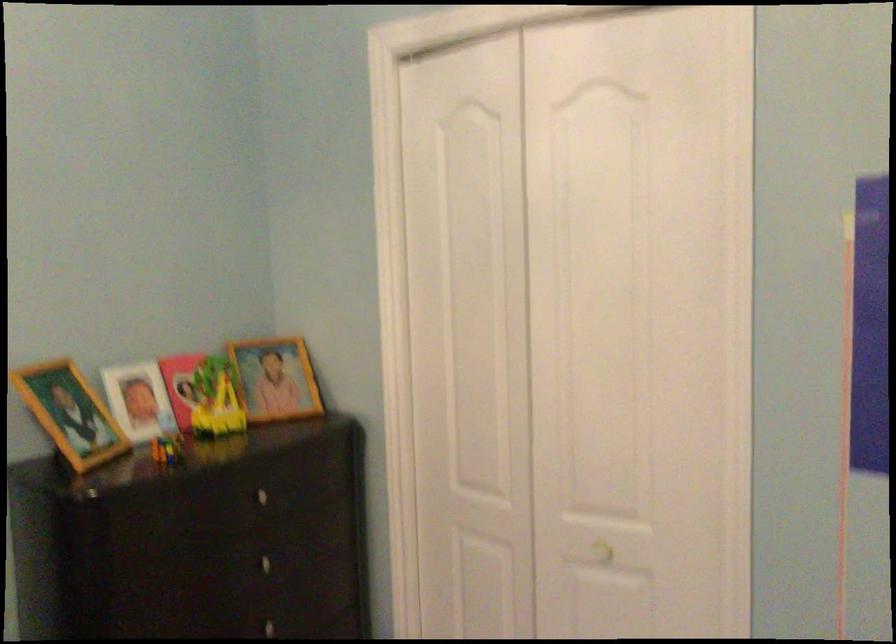
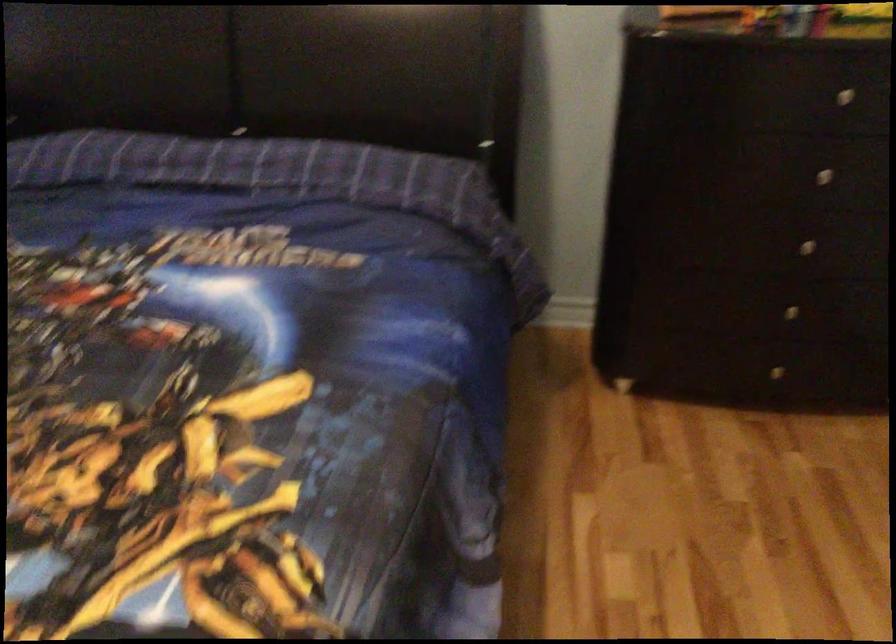
Consider the image. The first image is from the beginning of the video and the second image is from the end. How did the camera likely rotate when shooting the video?

The camera's rotation is toward left-down.